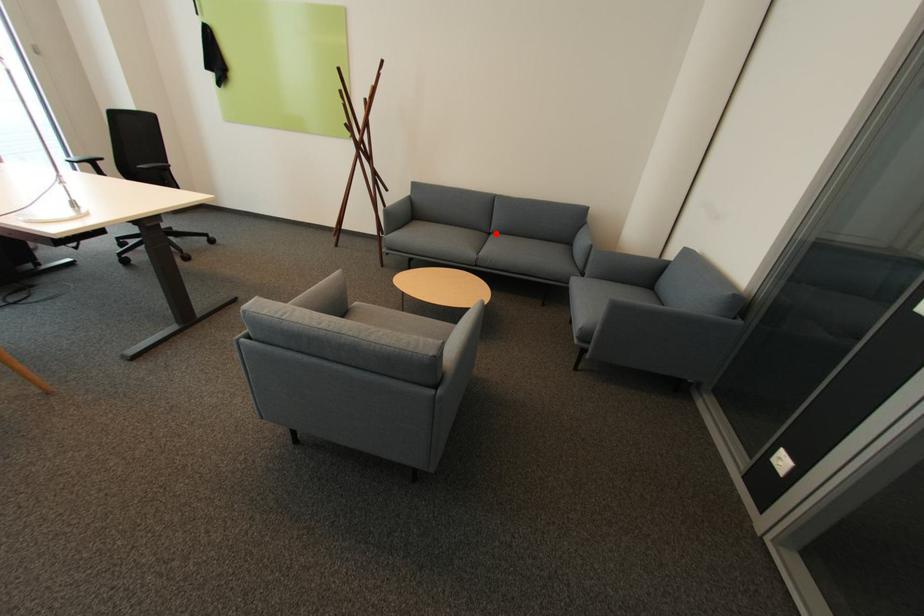
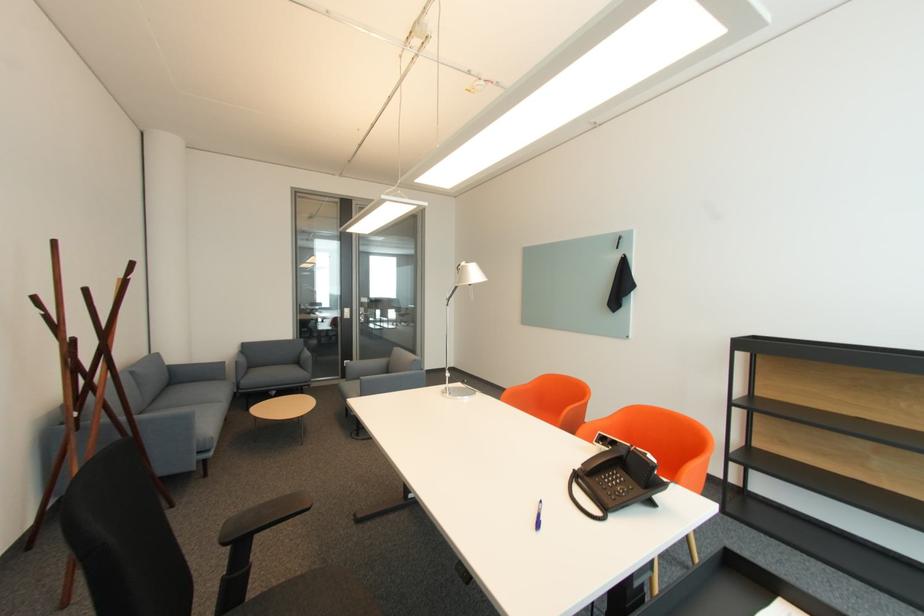
Question: I am providing you with two images of the same scene from different viewpoints. Image1 has a red point marked. In image2, the corresponding 3D location appears at what relative position? Reply with the corresponding letter.

Choices:
 (A) Closer
 (B) Farther

Answer: (B)